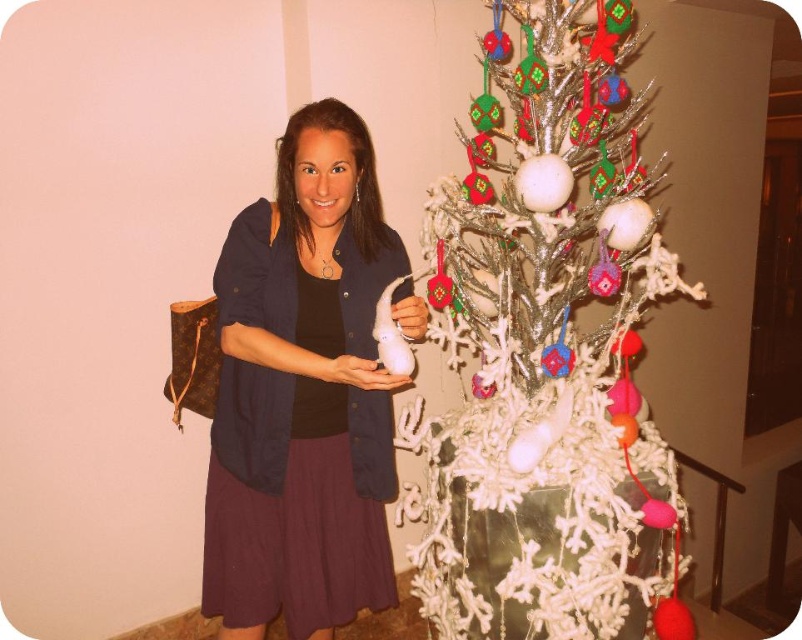
Does white textured christmas tree at center have a lesser width compared to matte black sweater at center?

In fact, white textured christmas tree at center might be wider than matte black sweater at center.

Which of these two, white textured christmas tree at center or matte black sweater at center, stands shorter?

Standing shorter between the two is matte black sweater at center.

Between point (468, 288) and point (264, 240), which one is positioned behind?

The point (468, 288) is behind.

I want to click on white textured christmas tree at center, so click(x=549, y=355).